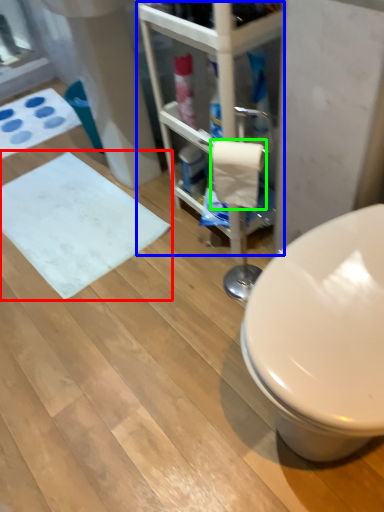
Question: Based on their relative distances, which object is farther from bath mat (highlighted by a red box)? Choose from shelf (highlighted by a blue box) and toilet paper (highlighted by a green box).

Choices:
 (A) shelf
 (B) toilet paper

Answer: (B)